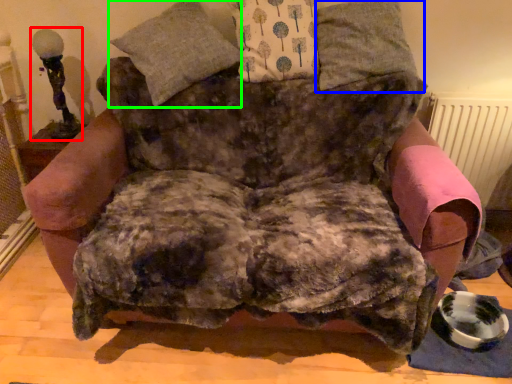
Question: Which object is the farthest from table lamp (highlighted by a red box)? Choose among these: pillow (highlighted by a blue box) or pillow (highlighted by a green box).

Choices:
 (A) pillow
 (B) pillow

Answer: (A)